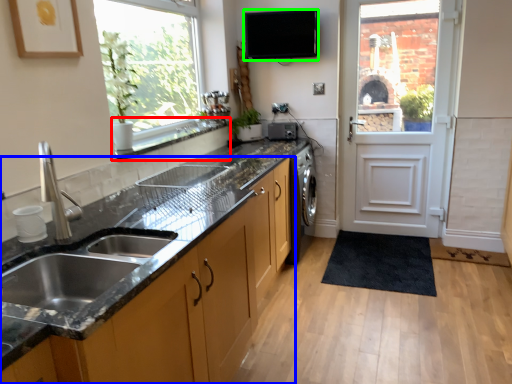
Question: Which object is the closest to the window sill (highlighted by a red box)? Choose among these: cabinetry (highlighted by a blue box) or appliance (highlighted by a green box).

Choices:
 (A) cabinetry
 (B) appliance

Answer: (B)